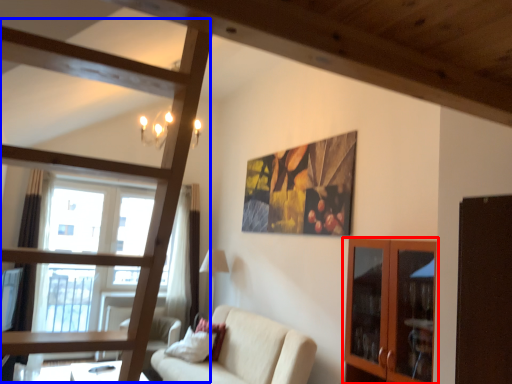
Question: Which of the following is the closest to the observer, cabinetry (highlighted by a red box) or bunk bed (highlighted by a blue box)?

Choices:
 (A) cabinetry
 (B) bunk bed

Answer: (B)